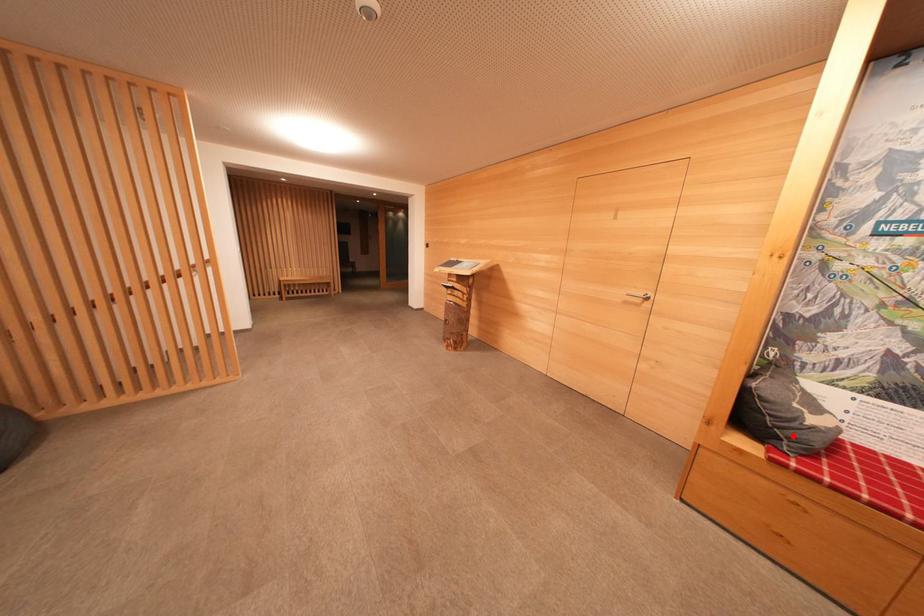
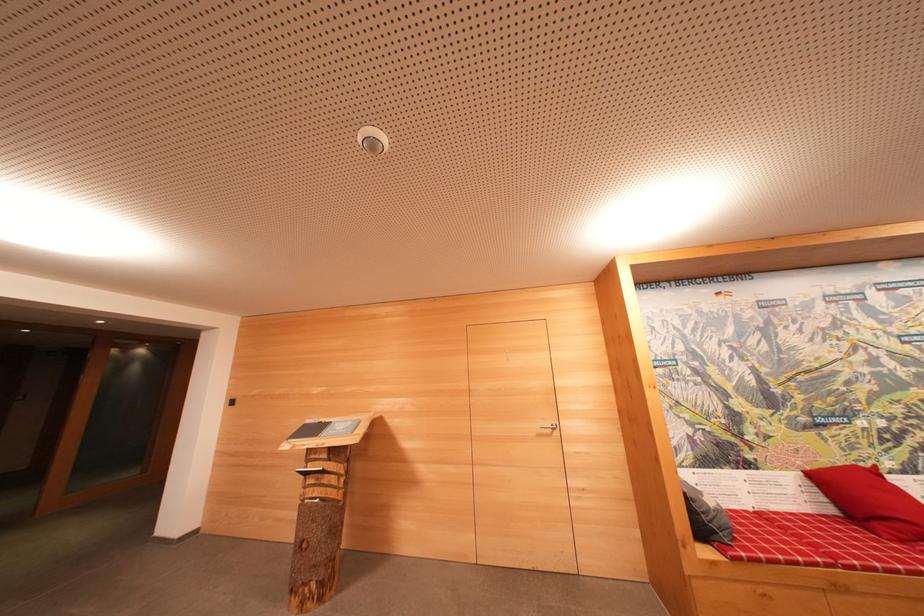
Where in the second image is the point corresponding to the highlighted location from the first image?

(720, 527)